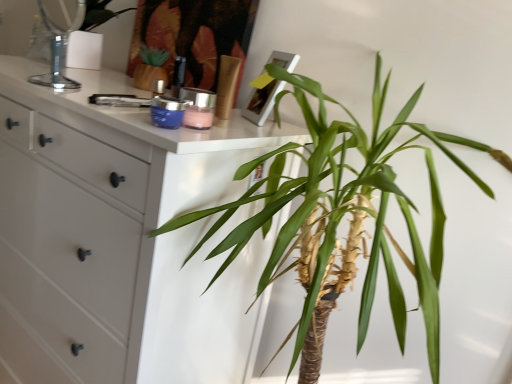
Question: Does white matte chest of drawers at left appear on the right side of shiny gold lotion at center?

Choices:
 (A) no
 (B) yes

Answer: (A)

Question: From a real-world perspective, is white matte chest of drawers at left over shiny gold lotion at center?

Choices:
 (A) yes
 (B) no

Answer: (B)

Question: Is white matte chest of drawers at left wider than shiny gold lotion at center?

Choices:
 (A) no
 (B) yes

Answer: (B)

Question: Is white matte chest of drawers at left positioned beyond the bounds of shiny gold lotion at center?

Choices:
 (A) no
 (B) yes

Answer: (B)

Question: From a real-world perspective, is white matte chest of drawers at left below shiny gold lotion at center?

Choices:
 (A) no
 (B) yes

Answer: (B)

Question: Does white matte chest of drawers at left have a smaller size compared to shiny gold lotion at center?

Choices:
 (A) yes
 (B) no

Answer: (B)

Question: Is white matte chest of drawers at left turned away from clear glass mirror at upper left?

Choices:
 (A) yes
 (B) no

Answer: (B)

Question: From a real-world perspective, is white matte chest of drawers at left over clear glass mirror at upper left?

Choices:
 (A) yes
 (B) no

Answer: (B)

Question: Does white matte chest of drawers at left contain clear glass mirror at upper left?

Choices:
 (A) no
 (B) yes

Answer: (A)

Question: From the image's perspective, is white matte chest of drawers at left under clear glass mirror at upper left?

Choices:
 (A) no
 (B) yes

Answer: (B)

Question: Is white matte chest of drawers at left far from clear glass mirror at upper left?

Choices:
 (A) no
 (B) yes

Answer: (A)

Question: Can you confirm if white matte chest of drawers at left is positioned to the left of clear glass mirror at upper left?

Choices:
 (A) yes
 (B) no

Answer: (A)

Question: Does green leafy plant at center have a larger size compared to white matte chest of drawers at left?

Choices:
 (A) no
 (B) yes

Answer: (A)